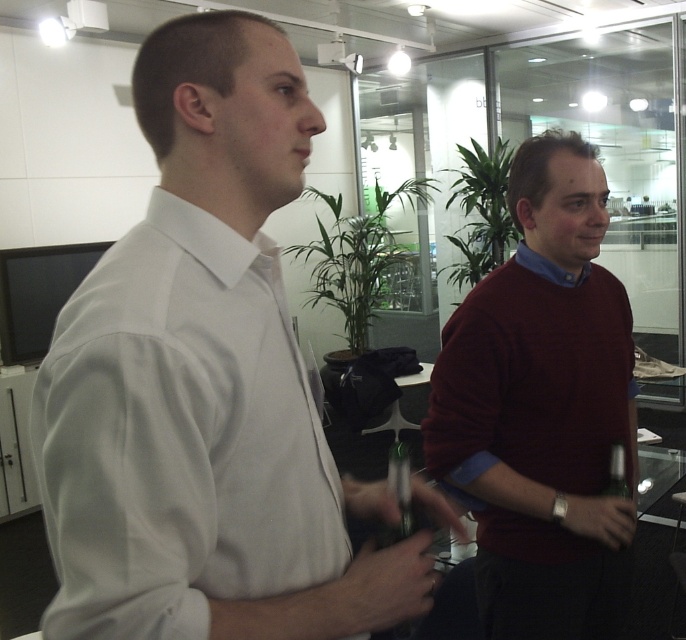
Which of these two, white smooth shirt at center or maroon sweater at right, stands shorter?

Standing shorter between the two is white smooth shirt at center.

Which is in front, point (158, 56) or point (591, 449)?

Positioned in front is point (158, 56).

Locate an element on the screen. white smooth shirt at center is located at coordinates (204, 385).